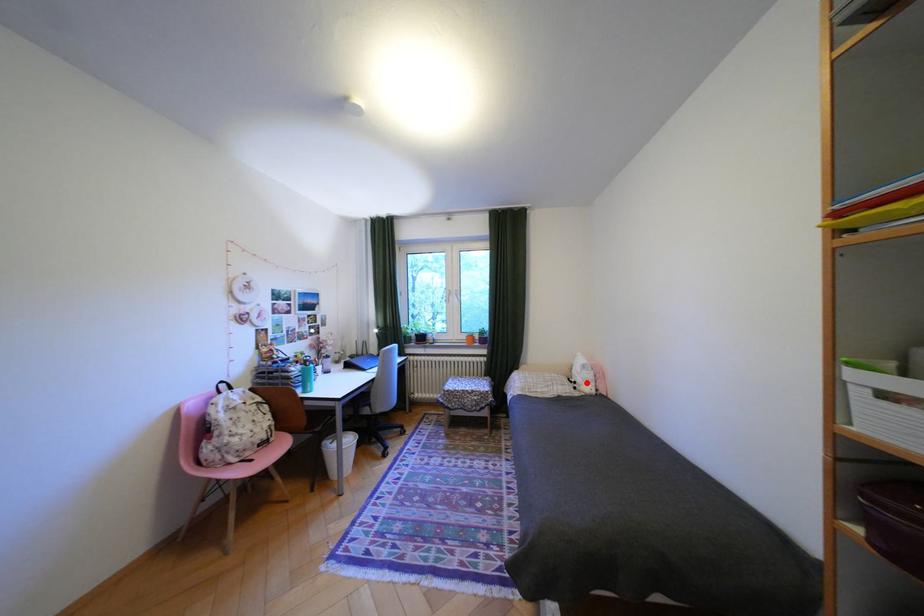
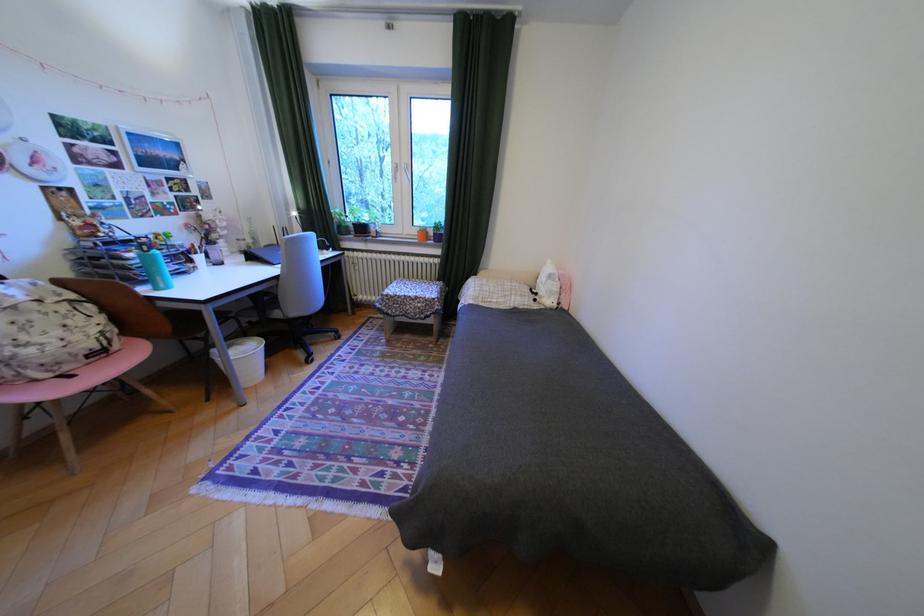
Question: I am providing you with two images of the same scene from different viewpoints. Given a red point in image1, look at the same physical point in image2. Is it:

Choices:
 (A) Closer to the viewpoint
 (B) Farther from the viewpoint

Answer: (A)